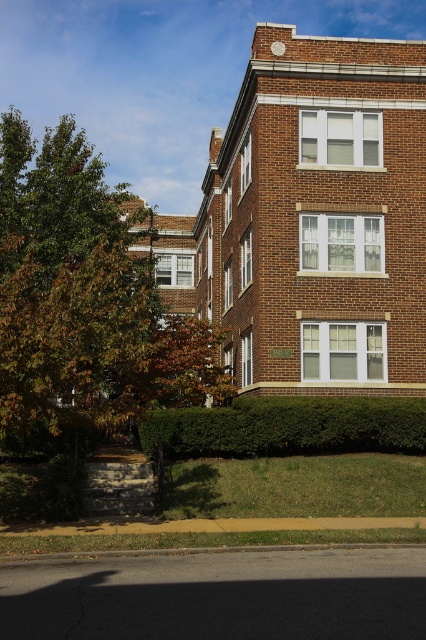
Question: Is green leafy tree at upper left smaller than green leafy hedge at lower center?

Choices:
 (A) no
 (B) yes

Answer: (A)

Question: Can you confirm if green leafy tree at upper left is wider than green leafy hedge at lower center?

Choices:
 (A) yes
 (B) no

Answer: (A)

Question: Is green leafy tree at upper left thinner than green leafy hedge at lower center?

Choices:
 (A) no
 (B) yes

Answer: (A)

Question: Among these objects, which one is nearest to the camera?

Choices:
 (A) green leafy tree at upper left
 (B) green leafy hedge at lower center

Answer: (A)